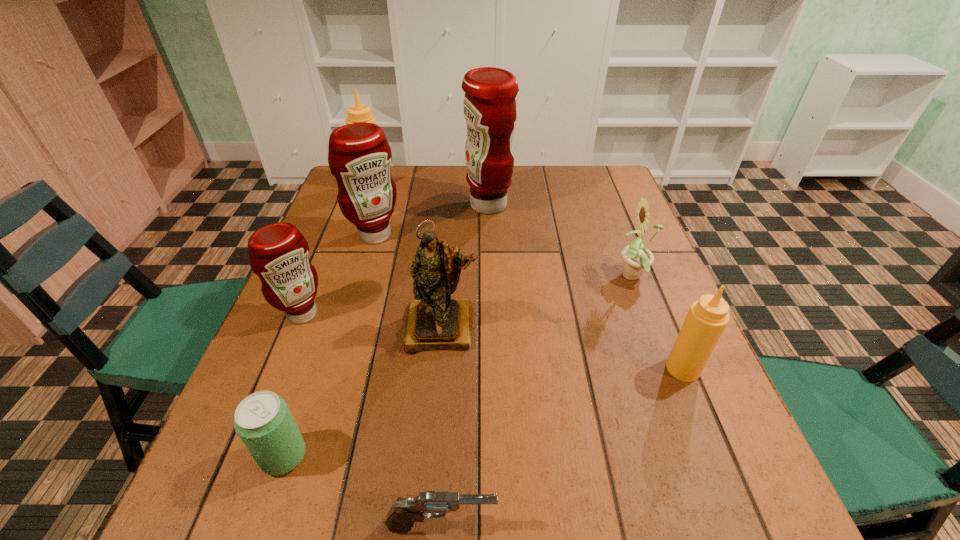
I want to click on free space located on the front of the nearer tan condiment, so click(x=725, y=469).

This screenshot has height=540, width=960. In order to click on free space located 0.110m on the front of the second nearest condiment in this screenshot , I will do `click(278, 373)`.

In order to click on blank area located on the front-facing side of the sunflower in this screenshot , I will do `click(588, 278)`.

Where is `vacant space located 0.360m on the front-facing side of the sunflower`? vacant space located 0.360m on the front-facing side of the sunflower is located at coordinates (467, 278).

At what (x,y) coordinates should I click in order to perform the action: click on blank space located on the front-facing side of the sunflower. Please return your answer as a coordinate pair (x, y). Image resolution: width=960 pixels, height=540 pixels. Looking at the image, I should click on (491, 278).

This screenshot has height=540, width=960. What are the coordinates of `free space located on the right of the second nearest object` in the screenshot? It's located at (507, 456).

You are a GUI agent. You are given a task and a screenshot of the screen. Output one action in this format:
    pyautogui.click(x=<x>, y=<y>)
    Task: Click on the free space located 0.280m at the barrel of the shortest object
    This screenshot has width=960, height=540.
    Given the screenshot: What is the action you would take?
    pyautogui.click(x=681, y=525)

At what (x,y) coordinates should I click in order to perform the action: click on object that is at the near edge. Please return your answer as a coordinate pair (x, y). Looking at the image, I should click on (433, 504).

Locate an element on the screen. soda that is at the left edge is located at coordinates (265, 425).

The image size is (960, 540). In order to click on condiment present at the right edge in this screenshot , I will do `click(707, 318)`.